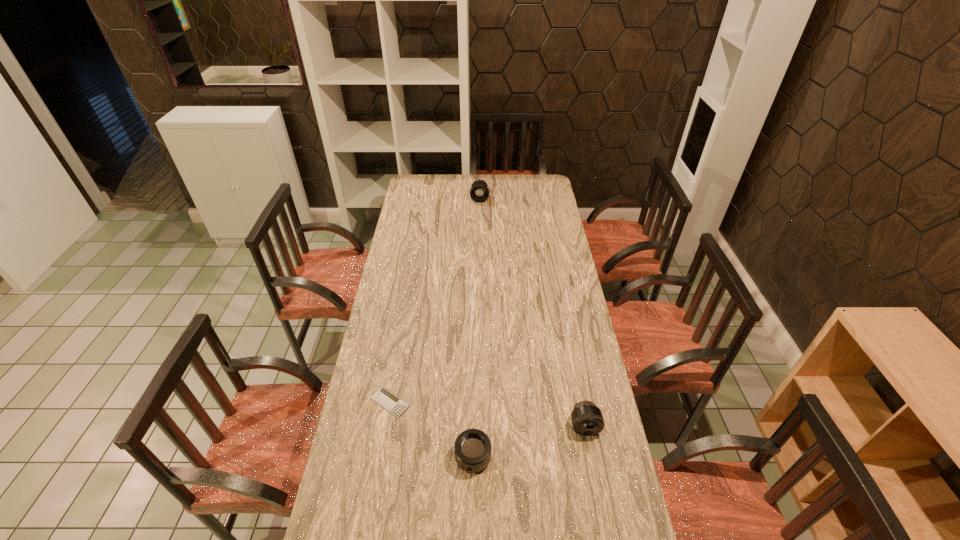
Identify which object is located as the third nearest to the calculator. Please provide its 2D coordinates. Your answer should be formatted as a tuple, i.e. [(x, y)], where the tuple contains the x and y coordinates of a point satisfying the conditions above.

[(479, 192)]

Locate which telephoto lens is the second closest to the third tallest object. Please provide its 2D coordinates. Your answer should be formatted as a tuple, i.e. [(x, y)], where the tuple contains the x and y coordinates of a point satisfying the conditions above.

[(479, 192)]

Where is `telephoto lens that stands as the second closest to the rightmost object`? telephoto lens that stands as the second closest to the rightmost object is located at coordinates (479, 192).